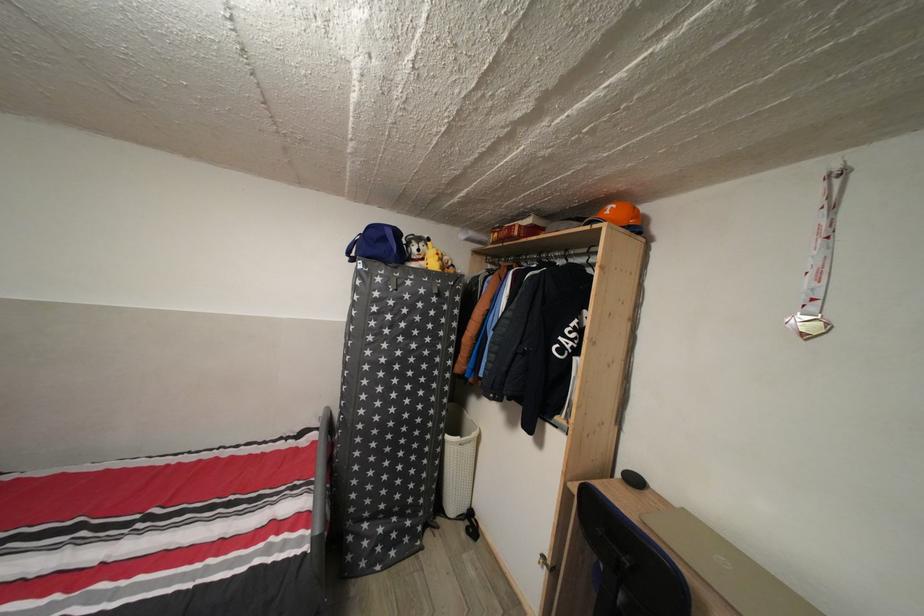
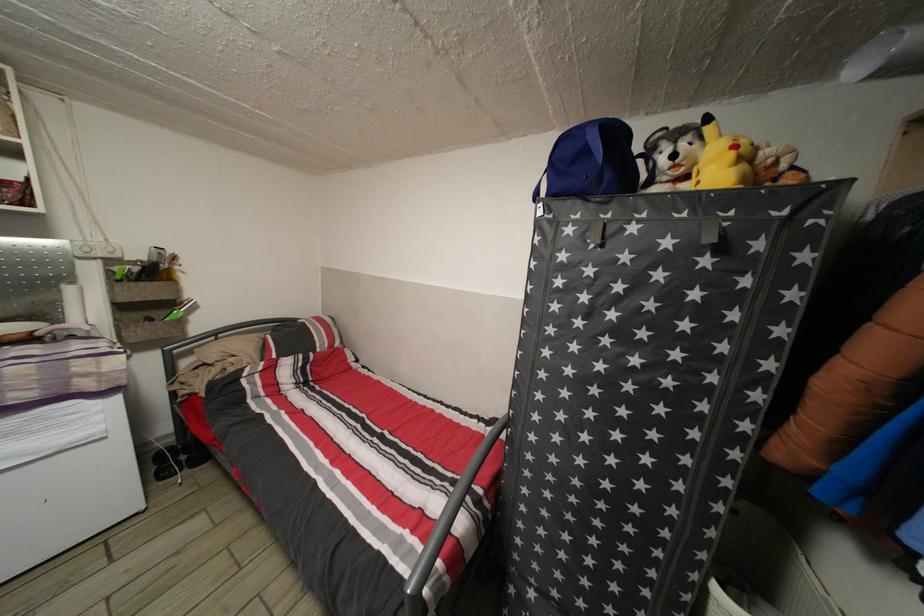
Locate, in the second image, the point that corresponds to (x=416, y=290) in the first image.

(639, 235)